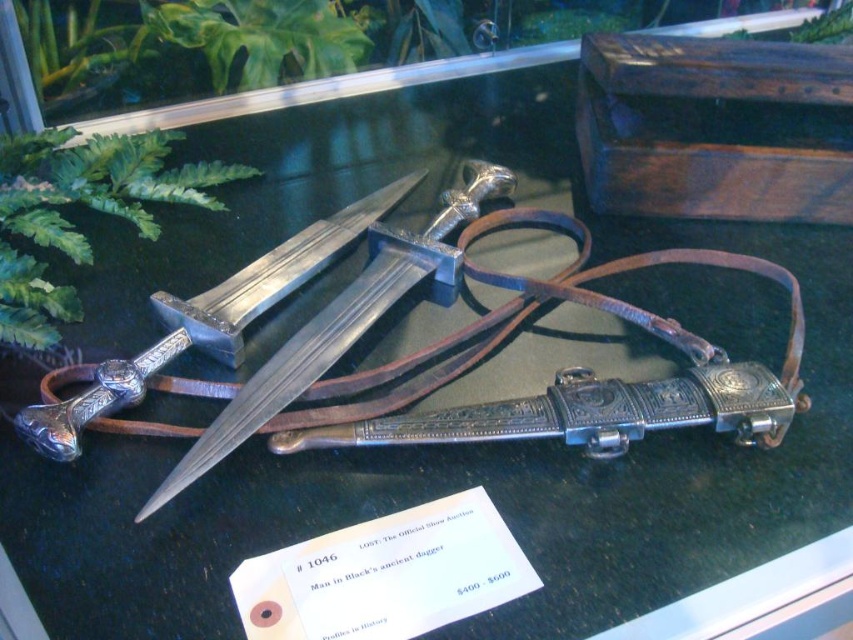
Question: Which point appears closest to the camera in this image?

Choices:
 (A) (194, 332)
 (B) (332, 310)

Answer: (A)

Question: Is polished silver sword at center closer to the viewer compared to polished silver dagger at center?

Choices:
 (A) yes
 (B) no

Answer: (A)

Question: Which point is farther to the camera?

Choices:
 (A) polished silver sword at center
 (B) polished silver dagger at center

Answer: (B)

Question: Is polished silver sword at center to the left of polished silver dagger at center from the viewer's perspective?

Choices:
 (A) no
 (B) yes

Answer: (A)

Question: Which object appears farthest from the camera in this image?

Choices:
 (A) polished silver dagger at center
 (B) polished silver sword at center

Answer: (A)

Question: Does polished silver sword at center have a greater width compared to polished silver dagger at center?

Choices:
 (A) no
 (B) yes

Answer: (B)